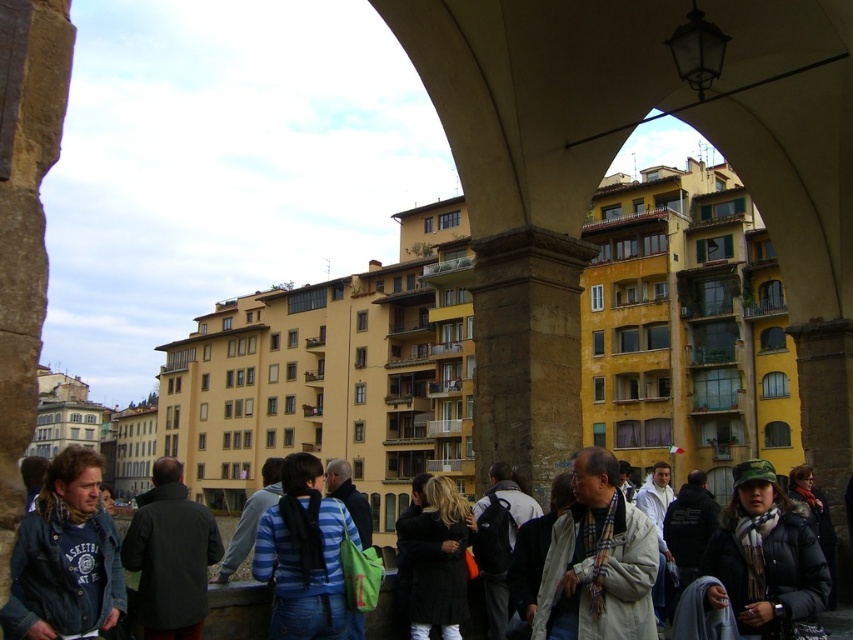
Is striped cotton shirt at center positioned before dark gray coat at center?

No, striped cotton shirt at center is behind dark gray coat at center.

This screenshot has width=853, height=640. Find the location of `striped cotton shirt at center`. striped cotton shirt at center is located at coordinates (305, 556).

Does point (287, 532) come farther from viewer compared to point (189, 612)?

Yes, it is behind point (189, 612).

The image size is (853, 640). What are the coordinates of `striped cotton shirt at center` in the screenshot? It's located at (305, 556).

How distant is white wool scarf at center from white wool scarf at lower right?

A distance of 10.63 feet exists between white wool scarf at center and white wool scarf at lower right.

In the scene shown: Does white wool scarf at center have a lesser height compared to white wool scarf at lower right?

Yes, white wool scarf at center is shorter than white wool scarf at lower right.

Does point (618, 515) come farther from viewer compared to point (529, 557)?

No, (618, 515) is in front of (529, 557).

Identify the location of white wool scarf at center. Image resolution: width=853 pixels, height=640 pixels. (596, 561).

Which of these two, denim jacket at lower left or white wool scarf at center, stands shorter?

Standing shorter between the two is white wool scarf at center.

Who is positioned more to the left, denim jacket at lower left or white wool scarf at center?

Positioned to the left is denim jacket at lower left.

Is point (90, 518) closer to viewer compared to point (641, 573)?

Yes, point (90, 518) is closer to viewer.

The height and width of the screenshot is (640, 853). I want to click on denim jacket at lower left, so click(65, 557).